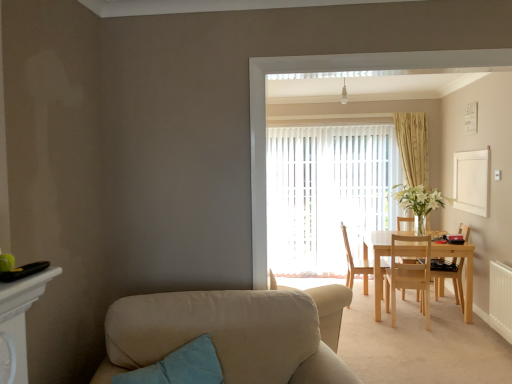
Find the location of a particular element. The height and width of the screenshot is (384, 512). vacant space situated on the left part of light wood chair at center, which is the second chair from left to right is located at coordinates (368, 322).